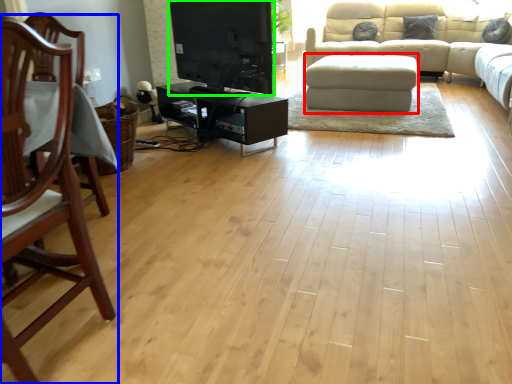
Question: Estimate the real-world distances between objects in this image. Which object is closer to footrest (highlighted by a red box), chair (highlighted by a blue box) or entertainment center (highlighted by a green box)?

Choices:
 (A) chair
 (B) entertainment center

Answer: (B)